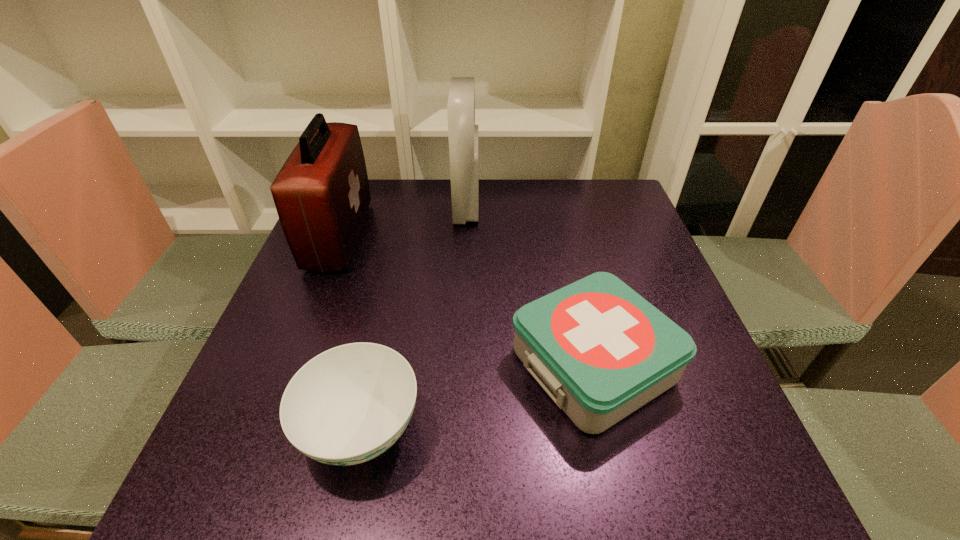
I want to click on the first aid kit that is at the left edge, so click(x=321, y=194).

Find the location of a particular element. chinaware present at the left edge is located at coordinates (349, 404).

Find the location of a particular element. object that is at the right edge is located at coordinates (601, 351).

This screenshot has height=540, width=960. Identify the location of object positioned at the far left corner. (321, 194).

What are the coordinates of `object situated at the near left corner` in the screenshot? It's located at (349, 404).

Identify the location of vacant position at the far edge of the desktop. (516, 182).

At what (x,y) coordinates should I click in order to perform the action: click on vacant space at the near edge of the desktop. Please return your answer as a coordinate pair (x, y). Looking at the image, I should click on 523,467.

Image resolution: width=960 pixels, height=540 pixels. I want to click on free space at the left edge of the desktop, so click(367, 267).

In the image, there is a desktop. Where is `vacant space at the right edge`? Image resolution: width=960 pixels, height=540 pixels. vacant space at the right edge is located at coordinates point(658,289).

Image resolution: width=960 pixels, height=540 pixels. In the image, there is a desktop. Find the location of `blank space at the far left corner`. blank space at the far left corner is located at coordinates (377, 198).